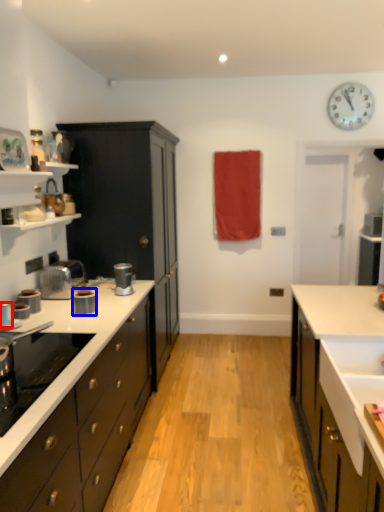
Question: Which object is further to the camera taking this photo, kitchen appliance (highlighted by a red box) or kitchen appliance (highlighted by a blue box)?

Choices:
 (A) kitchen appliance
 (B) kitchen appliance

Answer: (B)